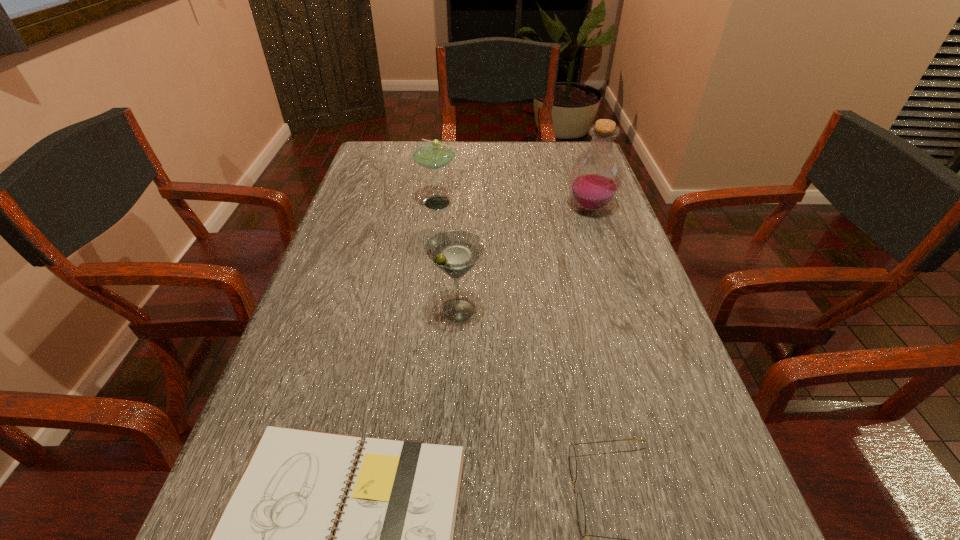
At what (x,y) coordinates should I click in order to perform the action: click on vacant space at the far right corner. Please return your answer as a coordinate pair (x, y). This screenshot has width=960, height=540. Looking at the image, I should click on (559, 169).

You are a GUI agent. You are given a task and a screenshot of the screen. Output one action in this format:
    pyautogui.click(x=<x>, y=<y>)
    Task: Click on the free space between the bottle and the nearer martini
    
    Given the screenshot: What is the action you would take?
    pyautogui.click(x=524, y=259)

Identify the location of the closest object relative to the third farthest object. (394, 539).

Locate which object is the fourth closest to the nearer martini. Please provide its 2D coordinates. Your answer should be formatted as a tuple, i.e. [(x, y)], where the tuple contains the x and y coordinates of a point satisfying the conditions above.

[(596, 176)]